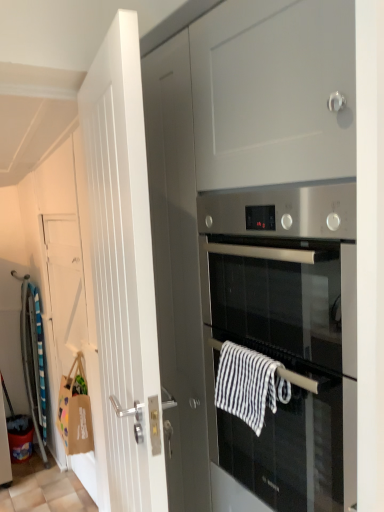
Describe the element at coordinates (283, 343) in the screenshot. Image resolution: width=384 pixels, height=512 pixels. I see `stainless steel oven at center` at that location.

Describe the element at coordinates (71, 291) in the screenshot. The height and width of the screenshot is (512, 384). I see `brown paper bag at left, positioned as the first door in left-to-right order` at that location.

Locate an element on the screen. The image size is (384, 512). stainless steel oven at center is located at coordinates (283, 343).

Is brown paper bag at left, the 1th door when ordered from back to front, located within white wooden door at left, acting as the 1th door starting from the front?

Definitely not — brown paper bag at left, the 1th door when ordered from back to front, is not inside white wooden door at left, acting as the 1th door starting from the front.

Which point is more forward, [143,285] or [67,225]?

The point [143,285] is closer to the camera.

From the image's perspective, is white wooden door at left, placed as the 2th door when sorted from left to right, positioned above or below brown paper bag at left, arranged as the second door when viewed from the right?

Based on their image positions, white wooden door at left, placed as the 2th door when sorted from left to right, is located above brown paper bag at left, arranged as the second door when viewed from the right.

Are white wooden door at left, placed as the 2th door when sorted from left to right, and brown paper bag at left, arranged as the second door when viewed from the right, beside each other?

They are not placed beside each other.

Does striped cotton hand towel at left, positioned as the second hand towel in front-to-back order, come behind black and white striped towel at center, placed as the 1th hand towel when sorted from front to back?

Yes, striped cotton hand towel at left, positioned as the second hand towel in front-to-back order, is further from the viewer.

This screenshot has width=384, height=512. What are the coordinates of `hand towel that appears below the black and white striped towel at center, positioned as the 1th hand towel in right-to-left order (from the image's perspective)` in the screenshot? It's located at (75, 412).

Is striped cotton hand towel at left, placed as the 2th hand towel when sorted from right to left, wider or thinner than black and white striped towel at center, the first hand towel when ordered from top to bottom?

Considering their sizes, striped cotton hand towel at left, placed as the 2th hand towel when sorted from right to left, looks broader than black and white striped towel at center, the first hand towel when ordered from top to bottom.

Does point (89, 430) come behind point (268, 362)?

Yes, point (89, 430) is farther from viewer.

Which is less distant, (x=98, y=442) or (x=273, y=466)?

Point (x=98, y=442) is positioned farther from the camera compared to point (x=273, y=466).

How different are the orientations of brown paper bag at left, the 1th door when ordered from back to front, and stainless steel oven at center in degrees?

brown paper bag at left, the 1th door when ordered from back to front, and stainless steel oven at center are facing 0.6 degrees away from each other.

Is brown paper bag at left, the 1th door when ordered from back to front, spatially inside stainless steel oven at center, or outside of it?

The correct answer is: outside.

Which object is closer to the camera, brown paper bag at left, positioned as the first door in left-to-right order, or stainless steel oven at center?

stainless steel oven at center is more forward.

There is a white wooden door at left, acting as the 1th door starting from the front. Identify the location of the 2nd hand towel below it (from the image's perspective). The image size is (384, 512). pos(75,412).

How far apart are striped cotton hand towel at left, which appears as the first hand towel when viewed from the left, and white wooden door at left, placed as the 2th door when sorted from left to right?

striped cotton hand towel at left, which appears as the first hand towel when viewed from the left, is 4.37 feet from white wooden door at left, placed as the 2th door when sorted from left to right.

Consider the image. Who is taller, striped cotton hand towel at left, positioned as the 2th hand towel in top-to-bottom order, or white wooden door at left, the second door viewed from the back?

With more height is white wooden door at left, the second door viewed from the back.

Who is shorter, brown paper bag at left, positioned as the first door in left-to-right order, or black and white striped towel at center, which ranks as the second hand towel in bottom-to-top order?

black and white striped towel at center, which ranks as the second hand towel in bottom-to-top order.

From the image's perspective, is brown paper bag at left, which appears as the second door when viewed from the front, over black and white striped towel at center, which is counted as the 2th hand towel, starting from the back?

No, from the image's perspective, brown paper bag at left, which appears as the second door when viewed from the front, is not over black and white striped towel at center, which is counted as the 2th hand towel, starting from the back.

Find the location of a particular element. door below the black and white striped towel at center, placed as the 1th hand towel when sorted from front to back (from the image's perspective) is located at coordinates tap(71, 291).

Looking at this image, does striped cotton hand towel at left, positioned as the 2th hand towel in top-to-bottom order, contain brown paper bag at left, positioned as the first door in left-to-right order?

No, brown paper bag at left, positioned as the first door in left-to-right order, is not inside striped cotton hand towel at left, positioned as the 2th hand towel in top-to-bottom order.

From a real-world perspective, is striped cotton hand towel at left, which appears as the first hand towel when viewed from the left, positioned above or below brown paper bag at left, arranged as the second door when viewed from the right?

Clearly, from a real-world perspective, striped cotton hand towel at left, which appears as the first hand towel when viewed from the left, is below brown paper bag at left, arranged as the second door when viewed from the right.

Looking at this image, is striped cotton hand towel at left, positioned as the 2th hand towel in top-to-bottom order, positioned in front of brown paper bag at left, positioned as the first door in left-to-right order?

Yes, striped cotton hand towel at left, positioned as the 2th hand towel in top-to-bottom order, is in front of brown paper bag at left, positioned as the first door in left-to-right order.

Considering the sizes of objects striped cotton hand towel at left, placed as the 2th hand towel when sorted from right to left, and brown paper bag at left, which appears as the second door when viewed from the front, in the image provided, who is smaller, striped cotton hand towel at left, placed as the 2th hand towel when sorted from right to left, or brown paper bag at left, which appears as the second door when viewed from the front,?

With smaller size is striped cotton hand towel at left, placed as the 2th hand towel when sorted from right to left.

Considering the positions of objects brown paper bag at left, positioned as the first door in left-to-right order, and striped cotton hand towel at left, positioned as the 2th hand towel in top-to-bottom order, in the image provided, who is more to the right, brown paper bag at left, positioned as the first door in left-to-right order, or striped cotton hand towel at left, positioned as the 2th hand towel in top-to-bottom order,?

Positioned to the right is striped cotton hand towel at left, positioned as the 2th hand towel in top-to-bottom order.

Is brown paper bag at left, arranged as the second door when viewed from the right, not close to striped cotton hand towel at left, placed as the 2th hand towel when sorted from right to left?

Actually, brown paper bag at left, arranged as the second door when viewed from the right, and striped cotton hand towel at left, placed as the 2th hand towel when sorted from right to left, are a little close together.

At what (x,y) coordinates should I click in order to perform the action: click on door below the white wooden door at left, acting as the 1th door starting from the front (from a real-world perspective). Please return your answer as a coordinate pair (x, y). This screenshot has height=512, width=384. Looking at the image, I should click on (71, 291).

This screenshot has height=512, width=384. What are the coordinates of `hand towel behind the black and white striped towel at center, positioned as the 1th hand towel in right-to-left order` in the screenshot? It's located at (75, 412).

Looking at the image, which one is located further to stainless steel oven at center, brown paper bag at left, the 1th door when ordered from back to front, or striped cotton hand towel at left, the first hand towel positioned from the bottom?

The object further to stainless steel oven at center is striped cotton hand towel at left, the first hand towel positioned from the bottom.

Based on their spatial positions, is white wooden door at left, placed as the 2th door when sorted from left to right, or striped cotton hand towel at left, positioned as the second hand towel in front-to-back order, further from black and white striped towel at center, the first hand towel when ordered from top to bottom?

striped cotton hand towel at left, positioned as the second hand towel in front-to-back order, lies further to black and white striped towel at center, the first hand towel when ordered from top to bottom, than the other object.

From the image, which object appears to be nearer to black and white striped towel at center, positioned as the 1th hand towel in right-to-left order, stainless steel oven at center or white wooden door at left, placed as the 2th door when sorted from left to right?

Based on the image, stainless steel oven at center appears to be nearer to black and white striped towel at center, positioned as the 1th hand towel in right-to-left order.

In the scene shown: Which object lies further to the anchor point brown paper bag at left, arranged as the second door when viewed from the right, black and white striped towel at center, positioned as the 1th hand towel in right-to-left order, or stainless steel oven at center?

Among the two, black and white striped towel at center, positioned as the 1th hand towel in right-to-left order, is located further to brown paper bag at left, arranged as the second door when viewed from the right.

Considering their positions, is white wooden door at left, the 1th door viewed from the right, positioned closer to brown paper bag at left, which appears as the second door when viewed from the front, than stainless steel oven at center?

Based on the image, white wooden door at left, the 1th door viewed from the right, appears to be nearer to brown paper bag at left, which appears as the second door when viewed from the front.

Consider the image. Which object lies further to the anchor point brown paper bag at left, arranged as the second door when viewed from the right, striped cotton hand towel at left, positioned as the second hand towel in front-to-back order, or black and white striped towel at center, positioned as the 1th hand towel in right-to-left order?

black and white striped towel at center, positioned as the 1th hand towel in right-to-left order, is positioned further to the anchor brown paper bag at left, arranged as the second door when viewed from the right.

Looking at the image, which one is located closer to black and white striped towel at center, which is counted as the 2th hand towel, starting from the back, white wooden door at left, the second door viewed from the back, or brown paper bag at left, positioned as the first door in left-to-right order?

white wooden door at left, the second door viewed from the back, is positioned closer to the anchor black and white striped towel at center, which is counted as the 2th hand towel, starting from the back.

Based on their spatial positions, is striped cotton hand towel at left, which appears as the first hand towel when viewed from the left, or white wooden door at left, placed as the 2th door when sorted from left to right, further from stainless steel oven at center?

Among the two, striped cotton hand towel at left, which appears as the first hand towel when viewed from the left, is located further to stainless steel oven at center.

This screenshot has width=384, height=512. What are the coordinates of `door positioned between stainless steel oven at center and brown paper bag at left, which appears as the second door when viewed from the front, from near to far` in the screenshot? It's located at (123, 271).

Locate an element on the screen. This screenshot has width=384, height=512. hand towel located between stainless steel oven at center and striped cotton hand towel at left, the first hand towel when ordered from back to front, in the depth direction is located at coordinates (249, 385).

I want to click on hand towel positioned between black and white striped towel at center, placed as the second hand towel when sorted from left to right, and brown paper bag at left, arranged as the second door when viewed from the right, from near to far, so click(75, 412).

Locate an element on the screen. Image resolution: width=384 pixels, height=512 pixels. hand towel situated between white wooden door at left, placed as the 2th door when sorted from left to right, and stainless steel oven at center from left to right is located at coordinates (249, 385).